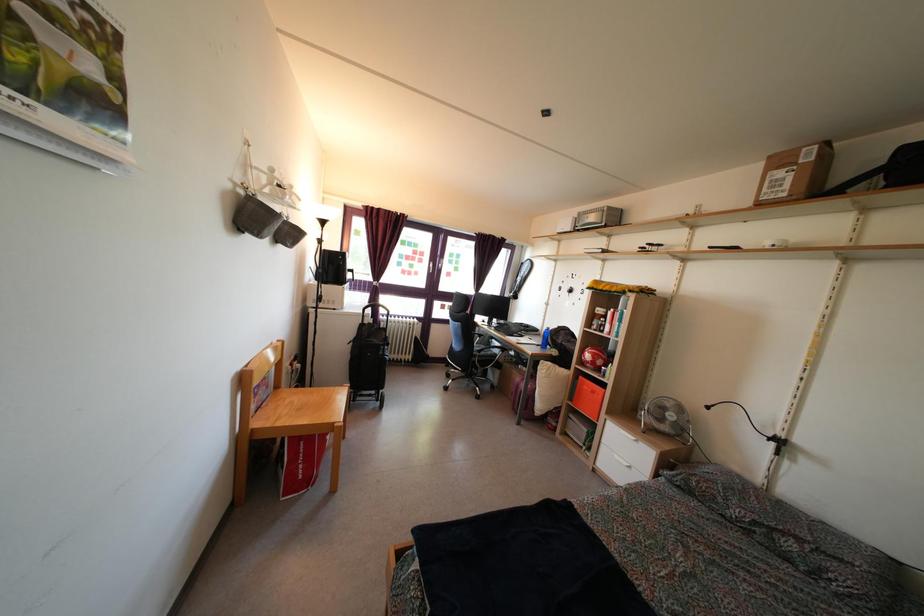
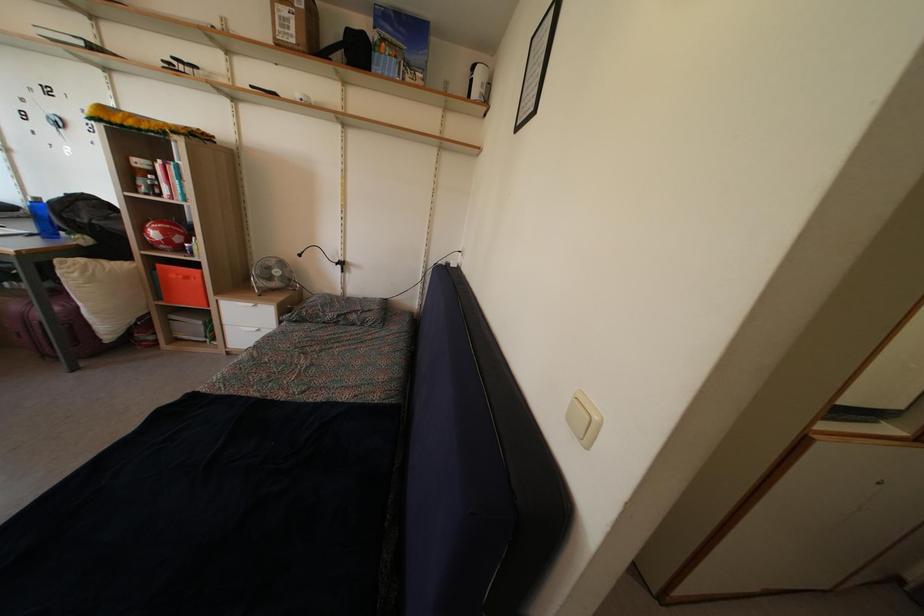
The point at (604, 455) is marked in the first image. Where is the corresponding point in the second image?

(228, 336)